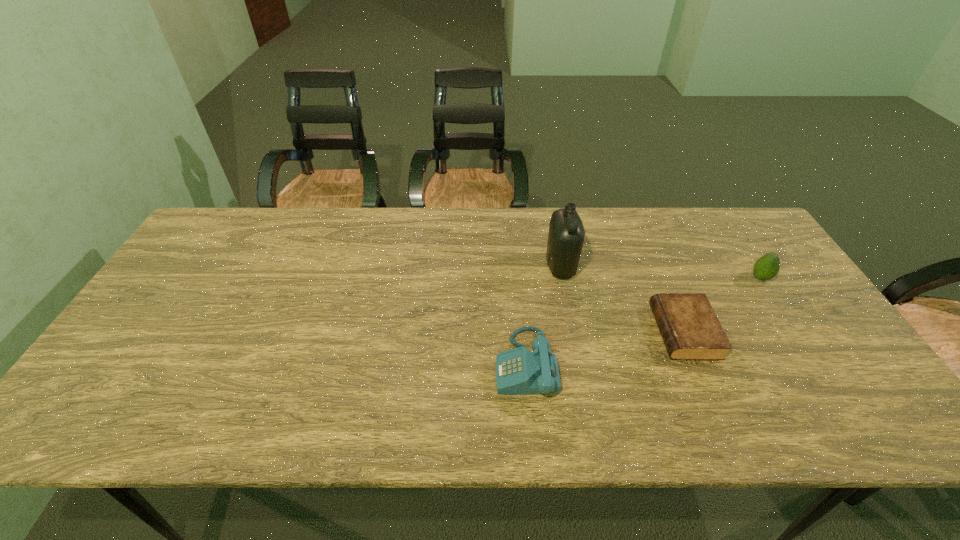
Locate an element on the screen. vacant space at the right edge of the desktop is located at coordinates (859, 386).

This screenshot has height=540, width=960. In the image, there is a desktop. Find the location of `blank space at the far left corner`. blank space at the far left corner is located at coordinates (206, 233).

This screenshot has height=540, width=960. I want to click on unoccupied area between the second object from right to left and the leftmost object, so click(x=605, y=348).

Where is `vacant space that's between the telephone and the third object from right to left`? vacant space that's between the telephone and the third object from right to left is located at coordinates (543, 315).

The image size is (960, 540). I want to click on free spot between the leftmost object and the second object from left to right, so click(x=543, y=315).

Find the location of a particular element. The height and width of the screenshot is (540, 960). vacant space that's between the second object from left to right and the avocado is located at coordinates [660, 272].

You are a GUI agent. You are given a task and a screenshot of the screen. Output one action in this format:
    pyautogui.click(x=<x>, y=<y>)
    Task: Click on the blank region between the avocado and the bottle
    This screenshot has width=960, height=540.
    Given the screenshot: What is the action you would take?
    pyautogui.click(x=660, y=272)

Where is `free space that is in between the leftmost object and the shortest object`? free space that is in between the leftmost object and the shortest object is located at coordinates (605, 348).

Locate an element on the screen. The height and width of the screenshot is (540, 960). free space between the shortest object and the tallest object is located at coordinates (622, 299).

This screenshot has width=960, height=540. I want to click on vacant space in between the third object from right to left and the diary, so (x=622, y=299).